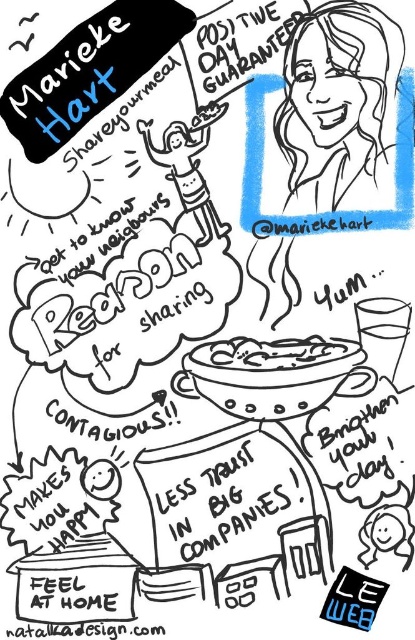
You are standing in front of the image and want to touch the two points labeled as point (397,49) and point (270,362). Which point would you need to reach out further to touch?

Point (270,362) is further away from you than point (397,49), so you would need to reach out further to touch point (270,362).

Based on the photo, you are designing a poster and need to ensure the text flows properly. The poster has the elements labeled as sketchy hair at upper right and white matte bowl at center. Which element should appear higher up on the poster to maintain visual hierarchy?

The sketchy hair at upper right should appear higher up on the poster because it is positioned above the white matte bowl at center.

You are a photographer standing at a certain distance from the image. You want to capture a closeup shot of the sketchy hair at upper right without moving the camera. Is the current distance sufficient for the closeup?

The sketchy hair at upper right is 24.11 inches from the camera, so if the photographer is at that distance, they can take a closeup without moving the camera.